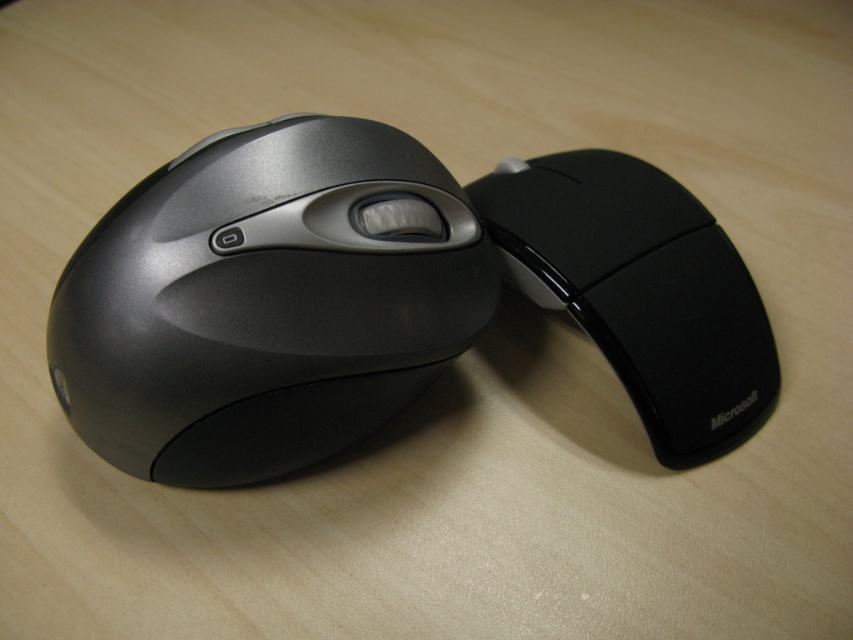
You are organizing a desk and need to place the satin black mouse at center and the black rubberized mouse at right in a straight line from left to right. Based on their positions, which mouse should be placed first on the left side of the desk?

The satin black mouse at center should be placed first on the left side of the desk because it is positioned to the left of the black rubberized mouse at right.

You are organizing a desk and have two mice to place. The satin black mouse at center and the black rubberized mouse at right. Which one should you choose if you need a larger mouse for better grip?

The satin black mouse at center is bigger than the black rubberized mouse at right, so it is better for a larger grip.